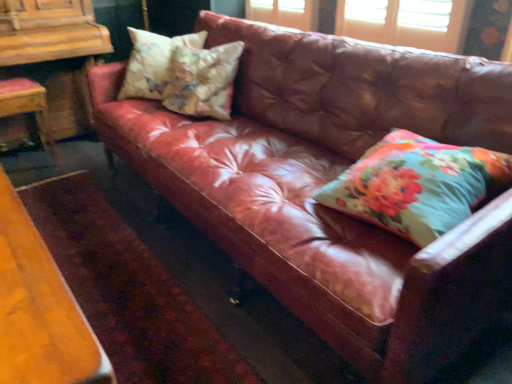
What is the approximate width of wooden dresser at left?

wooden dresser at left is 25.93 inches wide.

What is the approximate height of floral fabric pillow at upper left, positioned as the third pillow in front-to-back order?

It is 18.17 inches.

In order to click on wooden dresser at left in this screenshot , I will do `click(49, 32)`.

Is floral fabric pillow at upper left, positioned as the 3th pillow in right-to-left order, oriented towards wooden chair at left?

No, floral fabric pillow at upper left, positioned as the 3th pillow in right-to-left order, is not aimed at wooden chair at left.

Which of these two, floral fabric pillow at upper left, positioned as the third pillow in front-to-back order, or wooden chair at left, is smaller?

Smaller between the two is floral fabric pillow at upper left, positioned as the third pillow in front-to-back order.

From a real-world perspective, which is physically above, floral fabric pillow at upper left, positioned as the third pillow in front-to-back order, or wooden chair at left?

floral fabric pillow at upper left, positioned as the third pillow in front-to-back order, is physically above.

Does floral fabric pillow at upper left, acting as the first pillow starting from the left, appear on the right side of wooden chair at left?

Indeed, floral fabric pillow at upper left, acting as the first pillow starting from the left, is positioned on the right side of wooden chair at left.

From the picture: Which object is further away from the camera, floral fabric pillow at right, placed as the third pillow when sorted from back to front, or wooden chair at left?

wooden chair at left is behind.

Can you confirm if floral fabric pillow at right, placed as the third pillow when sorted from back to front, is smaller than wooden chair at left?

Yes, floral fabric pillow at right, placed as the third pillow when sorted from back to front, is smaller than wooden chair at left.

Identify the location of chair above the floral fabric pillow at right, which ranks as the first pillow in right-to-left order (from the image's perspective). Image resolution: width=512 pixels, height=384 pixels. tap(28, 107).

What's the angular difference between floral fabric pillow at right, placed as the 3th pillow when sorted from left to right, and wooden chair at left's facing directions?

The angle between the facing direction of floral fabric pillow at right, placed as the 3th pillow when sorted from left to right, and the facing direction of wooden chair at left is 90 degrees.

Would you consider wooden chair at left to be distant from floral fabric pillow at upper left, positioned as the third pillow in front-to-back order?

wooden chair at left is near floral fabric pillow at upper left, positioned as the third pillow in front-to-back order, not far away.

Identify the location of chair below the floral fabric pillow at upper left, acting as the first pillow starting from the left (from the image's perspective). (28, 107).

Which of these two, wooden chair at left or floral fabric pillow at upper left, positioned as the 3th pillow in right-to-left order, stands taller?

wooden chair at left is taller.

Can you confirm if floral fabric pillow at upper left, positioned as the third pillow in front-to-back order, is thinner than floral fabric pillow at right, placed as the third pillow when sorted from back to front?

Correct, the width of floral fabric pillow at upper left, positioned as the third pillow in front-to-back order, is less than that of floral fabric pillow at right, placed as the third pillow when sorted from back to front.

Which pillow is the 2nd one when counting from the left side of the floral fabric pillow at right, placed as the 3th pillow when sorted from left to right? Please provide its 2D coordinates.

[(153, 63)]

Is floral fabric pillow at upper left, positioned as the third pillow in front-to-back order, looking in the opposite direction of floral fabric pillow at right, which is the first pillow from front to back?

No, floral fabric pillow at upper left, positioned as the third pillow in front-to-back order, is not facing the opposite direction of floral fabric pillow at right, which is the first pillow from front to back.

In the image, is wooden chair at left positioned in front of or behind floral fabric pillow at right, which ranks as the first pillow in right-to-left order?

In the image, wooden chair at left appears behind floral fabric pillow at right, which ranks as the first pillow in right-to-left order.

Can you confirm if wooden chair at left is bigger than floral fabric pillow at right, which ranks as the first pillow in right-to-left order?

Indeed, wooden chair at left has a larger size compared to floral fabric pillow at right, which ranks as the first pillow in right-to-left order.

Can you confirm if wooden chair at left is positioned to the left of floral fabric pillow at right, which ranks as the first pillow in right-to-left order?

Yes.

In the scene shown: Is floral fabric pillow at upper left, the first pillow when ordered from back to front, not close to floral fabric cushion at upper left, the 2th pillow positioned from the right?

No, floral fabric pillow at upper left, the first pillow when ordered from back to front, is not far away from floral fabric cushion at upper left, the 2th pillow positioned from the right.

From the image's perspective, is floral fabric pillow at upper left, acting as the first pillow starting from the left, above floral fabric cushion at upper left, the 2th pillow positioned from the right?

Yes, from the image's perspective, floral fabric pillow at upper left, acting as the first pillow starting from the left, is above floral fabric cushion at upper left, the 2th pillow positioned from the right.

Measure the distance from floral fabric pillow at upper left, the first pillow when ordered from back to front, to floral fabric cushion at upper left, which is the second pillow from front to back.

7.17 inches.

What's the angular difference between floral fabric pillow at upper left, acting as the first pillow starting from the left, and floral fabric cushion at upper left, the 2th pillow positioned from the right,'s facing directions?

floral fabric pillow at upper left, acting as the first pillow starting from the left, and floral fabric cushion at upper left, the 2th pillow positioned from the right, are facing 22.1 degrees away from each other.

Can you confirm if floral fabric cushion at upper left, which ranks as the 2th pillow in left-to-right order, is thinner than wooden chair at left?

Indeed, floral fabric cushion at upper left, which ranks as the 2th pillow in left-to-right order, has a lesser width compared to wooden chair at left.

From the image's perspective, is floral fabric cushion at upper left, placed as the second pillow when sorted from back to front, located above or below wooden chair at left?

Clearly, from the image's perspective, floral fabric cushion at upper left, placed as the second pillow when sorted from back to front, is above wooden chair at left.

In the scene shown: From a real-world perspective, which is physically below, floral fabric cushion at upper left, the 2th pillow positioned from the right, or wooden chair at left?

From a 3D spatial view, wooden chair at left is below.

Which of these two, floral fabric cushion at upper left, which is the second pillow from front to back, or wooden chair at left, is bigger?

wooden chair at left is bigger.

Locate an element on the screen. This screenshot has width=512, height=384. chair that appears behind the floral fabric pillow at upper left, positioned as the third pillow in front-to-back order is located at coordinates (28, 107).

Identify the location of the 3rd pillow in front of the wooden chair at left, counting from the anchor's position. This screenshot has width=512, height=384. (416, 185).

Considering their positions, is wooden chair at left positioned further to floral fabric cushion at upper left, which ranks as the 2th pillow in left-to-right order, than wooden dresser at left?

wooden chair at left lies further to floral fabric cushion at upper left, which ranks as the 2th pillow in left-to-right order, than the other object.

From the image, which object appears to be farther from floral fabric pillow at right, which ranks as the first pillow in right-to-left order, wooden dresser at left or floral fabric cushion at upper left, which is the second pillow from front to back?

The object further to floral fabric pillow at right, which ranks as the first pillow in right-to-left order, is wooden dresser at left.

Looking at the image, which one is located closer to floral fabric pillow at upper left, the first pillow when ordered from back to front, wooden chair at left or wooden dresser at left?

Based on the image, wooden dresser at left appears to be nearer to floral fabric pillow at upper left, the first pillow when ordered from back to front.

Based on their spatial positions, is wooden dresser at left or wooden chair at left closer to floral fabric cushion at upper left, placed as the second pillow when sorted from back to front?

wooden dresser at left is positioned closer to the anchor floral fabric cushion at upper left, placed as the second pillow when sorted from back to front.

Which object lies further to the anchor point floral fabric cushion at upper left, which ranks as the 2th pillow in left-to-right order, floral fabric pillow at right, placed as the 3th pillow when sorted from left to right, or floral fabric pillow at upper left, the first pillow when ordered from back to front?

Based on the image, floral fabric pillow at right, placed as the 3th pillow when sorted from left to right, appears to be further to floral fabric cushion at upper left, which ranks as the 2th pillow in left-to-right order.

When comparing their distances from floral fabric pillow at upper left, positioned as the third pillow in front-to-back order, does wooden dresser at left or floral fabric pillow at right, which ranks as the first pillow in right-to-left order, seem closer?

wooden dresser at left.

Estimate the real-world distances between objects in this image. Which object is further from wooden dresser at left, floral fabric cushion at upper left, which is the second pillow from front to back, or floral fabric pillow at right, placed as the third pillow when sorted from back to front?

floral fabric pillow at right, placed as the third pillow when sorted from back to front, lies further to wooden dresser at left than the other object.

Looking at this image, based on their spatial positions, is floral fabric cushion at upper left, placed as the second pillow when sorted from back to front, or wooden dresser at left further from wooden chair at left?

Among the two, floral fabric cushion at upper left, placed as the second pillow when sorted from back to front, is located further to wooden chair at left.

Find the location of a particular element. This screenshot has width=512, height=384. dresser between wooden chair at left and floral fabric pillow at upper left, acting as the first pillow starting from the left, from left to right is located at coordinates (49, 32).

At what (x,y) coordinates should I click in order to perform the action: click on dresser between wooden chair at left and floral fabric pillow at right, which ranks as the first pillow in right-to-left order, from left to right. Please return your answer as a coordinate pair (x, y). Looking at the image, I should click on (49, 32).

The width and height of the screenshot is (512, 384). Identify the location of dresser between wooden chair at left and floral fabric cushion at upper left, which ranks as the 2th pillow in left-to-right order, from left to right. (49, 32).

This screenshot has width=512, height=384. I want to click on pillow located between wooden chair at left and floral fabric cushion at upper left, the 2th pillow positioned from the right, in the left-right direction, so click(x=153, y=63).